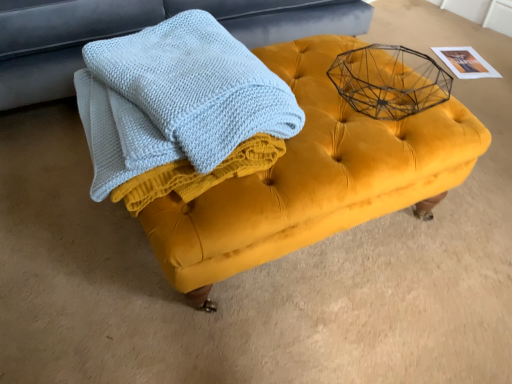
Question: Is velvet yellow ottoman at center with light blue knitted towel at center?

Choices:
 (A) no
 (B) yes

Answer: (A)

Question: Is velvet yellow ottoman at center further to camera compared to light blue knitted towel at center?

Choices:
 (A) yes
 (B) no

Answer: (A)

Question: Does velvet yellow ottoman at center turn towards light blue knitted towel at center?

Choices:
 (A) no
 (B) yes

Answer: (A)

Question: Can you confirm if velvet yellow ottoman at center is wider than light blue knitted towel at center?

Choices:
 (A) no
 (B) yes

Answer: (B)

Question: From a real-world perspective, is velvet yellow ottoman at center on top of light blue knitted towel at center?

Choices:
 (A) no
 (B) yes

Answer: (A)

Question: In terms of height, does velvet yellow ottoman at center look taller or shorter compared to light blue knitted towel at center?

Choices:
 (A) short
 (B) tall

Answer: (B)

Question: Considering the positions of point (11, 1) and point (197, 99), is point (11, 1) closer or farther from the camera than point (197, 99)?

Choices:
 (A) farther
 (B) closer

Answer: (A)

Question: From a real-world perspective, relative to light blue knitted towel at center, is velvet yellow ottoman at center vertically above or below?

Choices:
 (A) below
 (B) above

Answer: (A)

Question: From the image's perspective, relative to light blue knitted towel at center, is velvet yellow ottoman at center above or below?

Choices:
 (A) above
 (B) below

Answer: (A)

Question: Do you think light blue knitted towel at center is within velvet yellow ottoman at center, or outside of it?

Choices:
 (A) inside
 (B) outside

Answer: (B)

Question: From the image's perspective, is light blue knitted towel at center located above or below velvet yellow ottoman at center?

Choices:
 (A) below
 (B) above

Answer: (A)

Question: From their relative heights in the image, would you say light blue knitted towel at center is taller or shorter than velvet yellow ottoman at center?

Choices:
 (A) tall
 (B) short

Answer: (B)

Question: Is light blue knitted towel at center wider or thinner than velvet yellow ottoman at center?

Choices:
 (A) wide
 (B) thin

Answer: (B)

Question: Considering the relative positions of velvet yellow ottoman at center and light blue knitted towel at center in the image provided, is velvet yellow ottoman at center to the left or to the right of light blue knitted towel at center?

Choices:
 (A) right
 (B) left

Answer: (A)

Question: Is point (417, 167) closer or farther from the camera than point (125, 182)?

Choices:
 (A) closer
 (B) farther

Answer: (B)